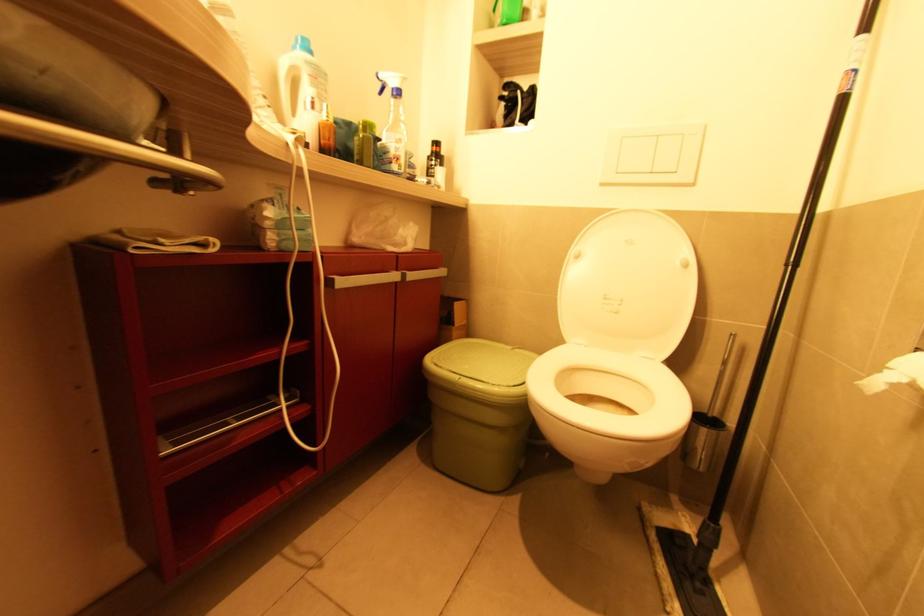
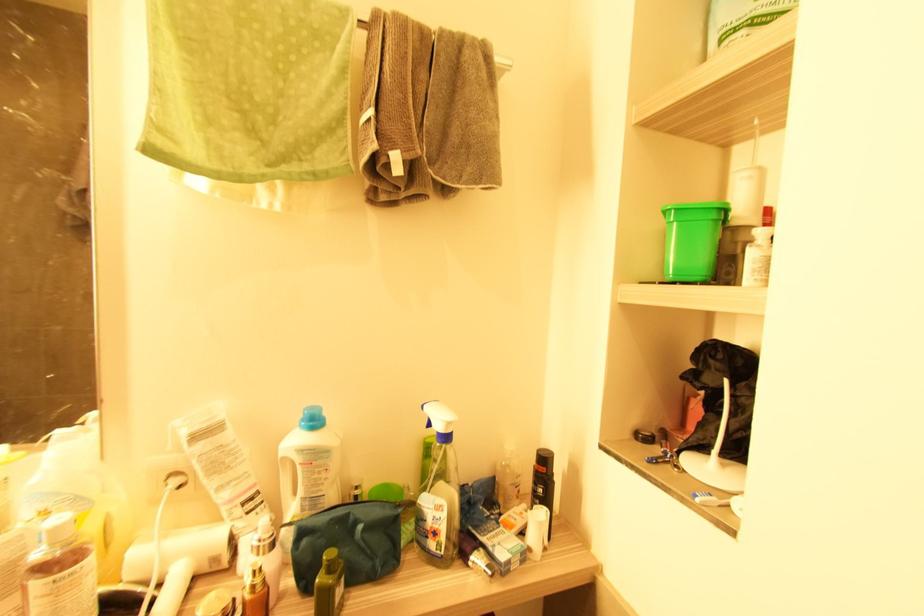
Locate, in the second image, the point that corresponds to point 321,79 in the first image.

(315, 464)